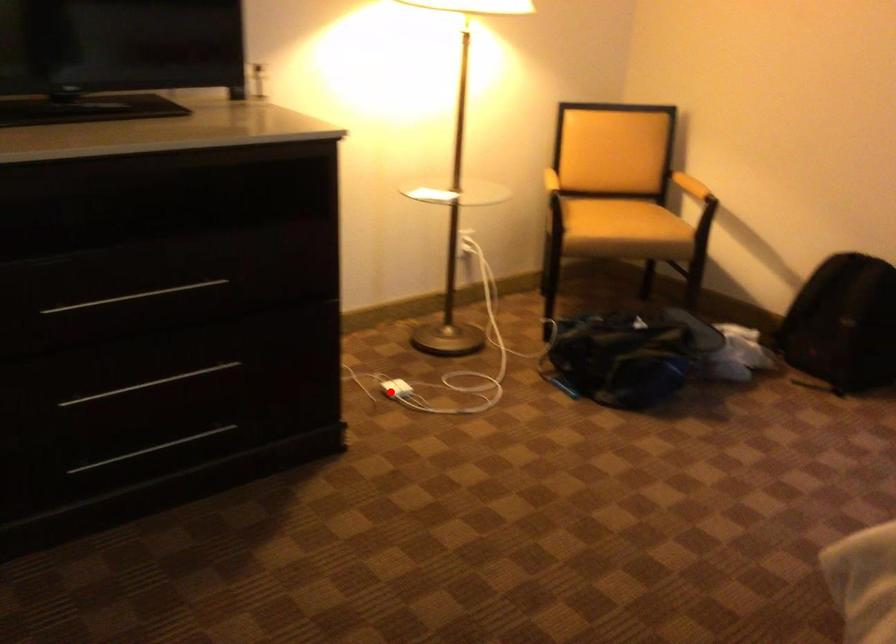
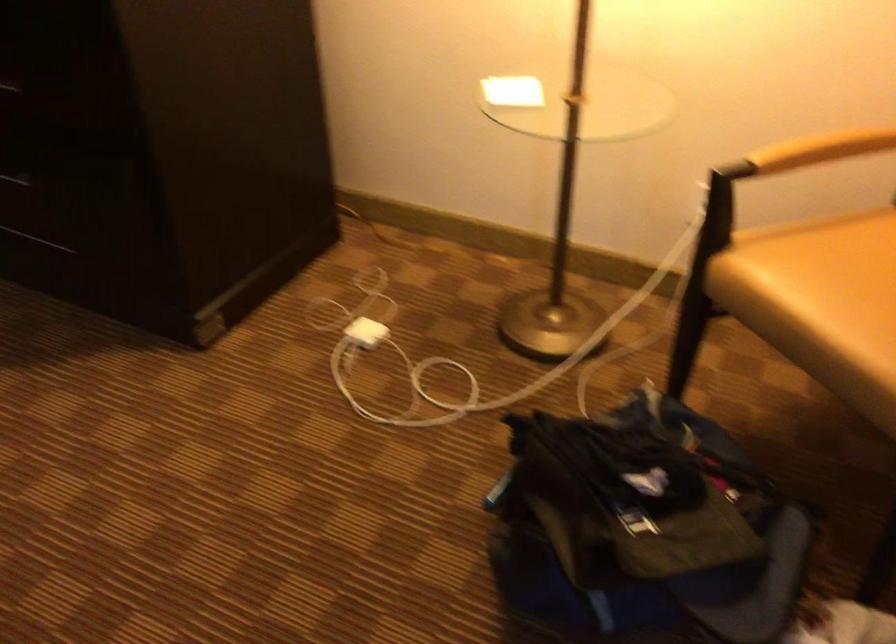
Locate, in the second image, the point that corresponds to the highlighted location in the first image.

(366, 332)